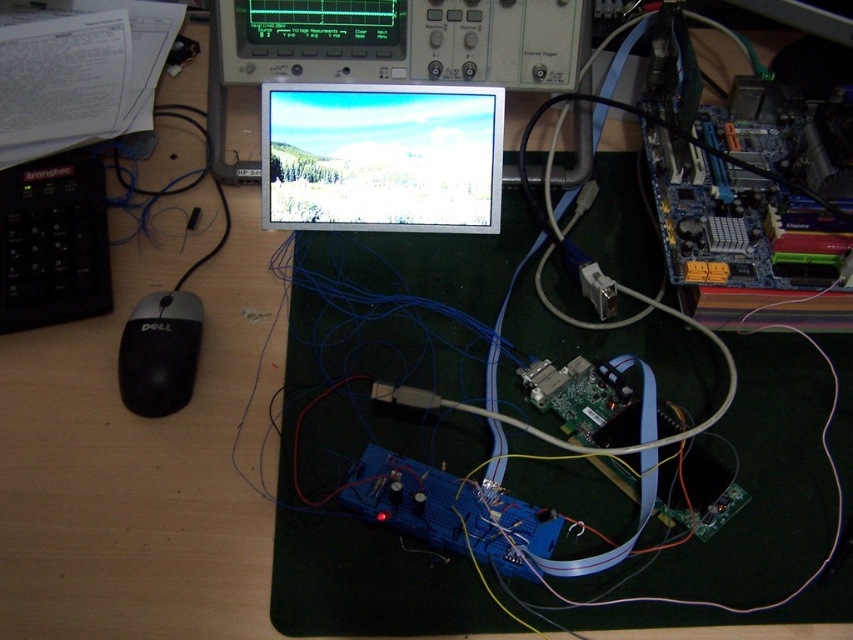
In the scene shown: You are setting up a new monitor stand and need to ensure it can support both the matte black screen at center and the black matte mouse at lower left. Based on their sizes, which one requires a taller stand?

The matte black screen at center requires a taller stand because it is much taller than the black matte mouse at lower left.

You are setting up a new workspace and want to ensure all your devices fit properly. You have a matte black screen at center and a black matte mouse at lower left. Which device has a greater width?

The matte black screen at center has a greater width than the black matte mouse at lower left according to the description.

You are organizing the desk in the workspace. You need to place a new document on the desk. Where should you place it so it doesn not block the view of the matte black screen at center and the black matte mouse at lower left?

Place the new document between the matte black screen at center and the black matte mouse at lower left since the matte black screen at center is above the black matte mouse at lower left, leaving space in between for the document without blocking either object.